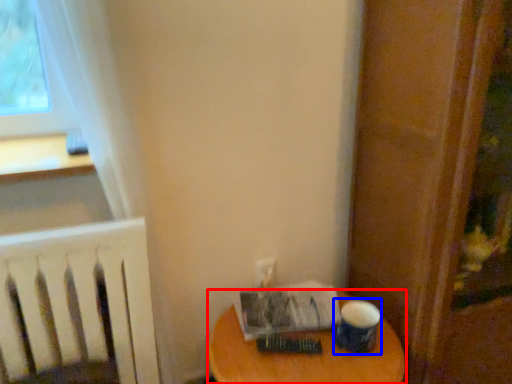
Question: Among these objects, which one is nearest to the camera, table (highlighted by a red box) or paper cup (highlighted by a blue box)?

Choices:
 (A) table
 (B) paper cup

Answer: (A)